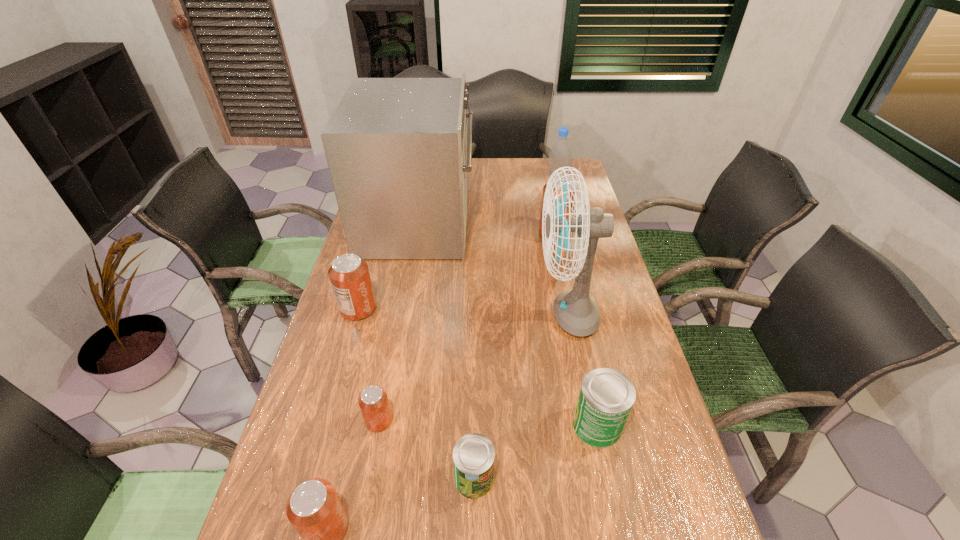
Find the location of a particular element. This screenshot has width=960, height=540. toaster oven is located at coordinates (397, 151).

This screenshot has width=960, height=540. In order to click on gray fan in this screenshot , I will do `click(576, 312)`.

Find the location of a particular element. The image size is (960, 540). the farthest object is located at coordinates (560, 155).

This screenshot has width=960, height=540. What are the coordinates of `gray bottle` in the screenshot? It's located at (560, 155).

Locate an element on the screen. The height and width of the screenshot is (540, 960). the rightmost orange can is located at coordinates (568, 177).

Where is `the farthest orange can`? This screenshot has width=960, height=540. the farthest orange can is located at coordinates (568, 177).

This screenshot has height=540, width=960. I want to click on the second farthest can, so click(349, 275).

Locate an element on the screen. the second farthest orange can is located at coordinates (349, 275).

At what (x,y) coordinates should I click in order to perform the action: click on the farther green can. Please return your answer as a coordinate pair (x, y). This screenshot has height=540, width=960. Looking at the image, I should click on (606, 397).

The height and width of the screenshot is (540, 960). I want to click on the right green can, so click(x=606, y=397).